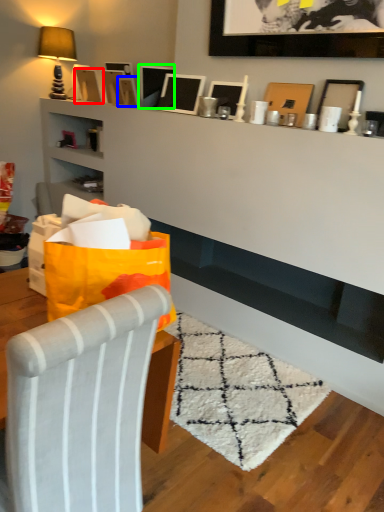
Question: Which object is positioned closest to picture frame (highlighted by a red box)? Select from picture frame (highlighted by a blue box) and picture frame (highlighted by a green box).

Choices:
 (A) picture frame
 (B) picture frame

Answer: (A)